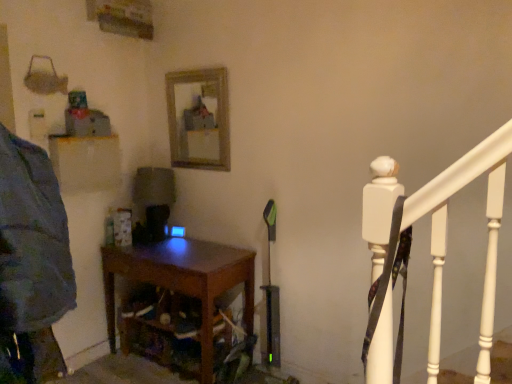
The width and height of the screenshot is (512, 384). In order to click on wooden frame mirror at upper center in this screenshot , I will do 199,118.

Image resolution: width=512 pixels, height=384 pixels. Describe the element at coordinates (199, 118) in the screenshot. I see `wooden frame mirror at upper center` at that location.

Image resolution: width=512 pixels, height=384 pixels. Describe the element at coordinates (183, 280) in the screenshot. I see `dark wood table at center` at that location.

What is the approximate width of dark wood table at center?

The width of dark wood table at center is 49.04 centimeters.

The height and width of the screenshot is (384, 512). Identify the location of dark wood table at center. (183, 280).

In order to click on wooden frame mirror at upper center in this screenshot , I will do `click(199, 118)`.

Looking at this image, which object is positioned more to the right, wooden frame mirror at upper center or dark wood table at center?

wooden frame mirror at upper center is more to the right.

Considering their positions, is wooden frame mirror at upper center located in front of or behind dark wood table at center?

Visually, wooden frame mirror at upper center is located behind dark wood table at center.

Does point (177, 119) come farther from viewer compared to point (172, 263)?

Yes, it is behind point (172, 263).

From the image's perspective, which is below, wooden frame mirror at upper center or dark wood table at center?

From the image's view, dark wood table at center is below.

From a real-world perspective, between wooden frame mirror at upper center and dark wood table at center, who is vertically higher?

In real-world perspective, wooden frame mirror at upper center is above.

Does wooden frame mirror at upper center have a lesser width compared to dark wood table at center?

Correct, the width of wooden frame mirror at upper center is less than that of dark wood table at center.

Which of these two, wooden frame mirror at upper center or dark wood table at center, stands shorter?

wooden frame mirror at upper center is shorter.

Which of these two, wooden frame mirror at upper center or dark wood table at center, is smaller?

With smaller size is wooden frame mirror at upper center.

In the scene shown: Which is correct: wooden frame mirror at upper center is inside dark wood table at center, or outside of it?

The correct answer is: outside.

Are wooden frame mirror at upper center and dark wood table at center located far from each other?

No, wooden frame mirror at upper center is in close proximity to dark wood table at center.

Is dark wood table at center at the back of wooden frame mirror at upper center?

No, wooden frame mirror at upper center's orientation is not away from dark wood table at center.

Can you tell me how much wooden frame mirror at upper center and dark wood table at center differ in facing direction?

There is a 1.1-degree angle between the facing directions of wooden frame mirror at upper center and dark wood table at center.

Locate an element on the screen. Image resolution: width=512 pixels, height=384 pixels. mirror behind the dark wood table at center is located at coordinates (199, 118).

Considering the relative positions of dark wood table at center and wooden frame mirror at upper center in the image provided, is dark wood table at center to the left or to the right of wooden frame mirror at upper center?

In the image, dark wood table at center appears on the left side of wooden frame mirror at upper center.

Does dark wood table at center lie behind wooden frame mirror at upper center?

That is False.

Considering the positions of points (144, 254) and (177, 99), is point (144, 254) farther from camera compared to point (177, 99)?

No.

From the image's perspective, which object appears higher, dark wood table at center or wooden frame mirror at upper center?

wooden frame mirror at upper center appears higher in the image.

From a real-world perspective, is dark wood table at center on top of wooden frame mirror at upper center?

No, from a real-world perspective, dark wood table at center is not above wooden frame mirror at upper center.

Which object is thinner, dark wood table at center or wooden frame mirror at upper center?

wooden frame mirror at upper center.

Which of these two, dark wood table at center or wooden frame mirror at upper center, stands taller?

dark wood table at center.

Does dark wood table at center have a larger size compared to wooden frame mirror at upper center?

Yes, dark wood table at center is bigger than wooden frame mirror at upper center.

Is wooden frame mirror at upper center completely or partially inside dark wood table at center?

Actually, wooden frame mirror at upper center is outside dark wood table at center.

Is dark wood table at center far away from wooden frame mirror at upper center?

dark wood table at center is actually quite close to wooden frame mirror at upper center.

Does dark wood table at center turn towards wooden frame mirror at upper center?

No.

Can you tell me how much dark wood table at center and wooden frame mirror at upper center differ in facing direction?

They differ by 1.1 degrees in their facing directions.

Where is `mirror above the dark wood table at center (from the image's perspective)`? The width and height of the screenshot is (512, 384). mirror above the dark wood table at center (from the image's perspective) is located at coordinates (199, 118).

This screenshot has height=384, width=512. What are the coordinates of `nightstand in front of the wooden frame mirror at upper center` in the screenshot? It's located at (183, 280).

What are the coordinates of `mirror positioned vertically above the dark wood table at center (from a real-world perspective)` in the screenshot? It's located at (199, 118).